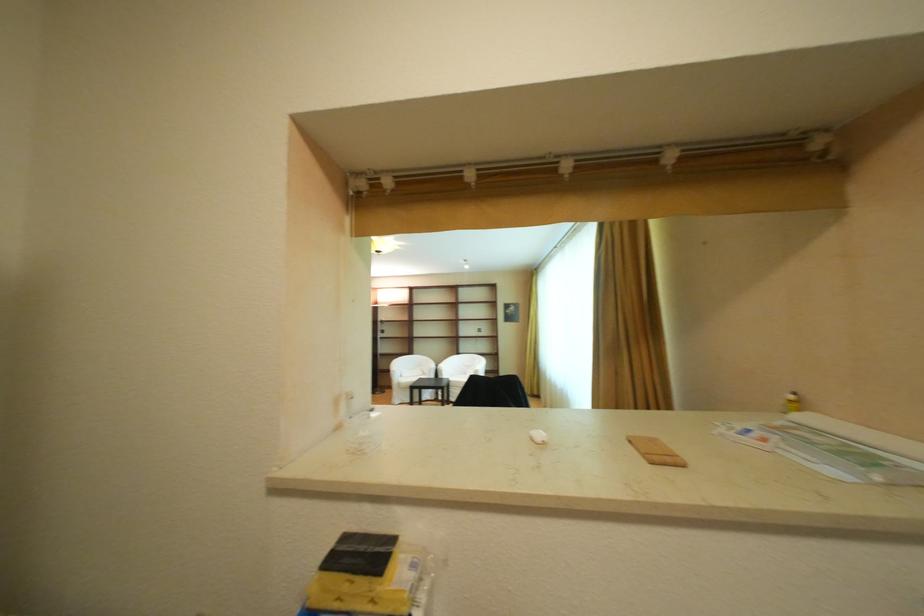
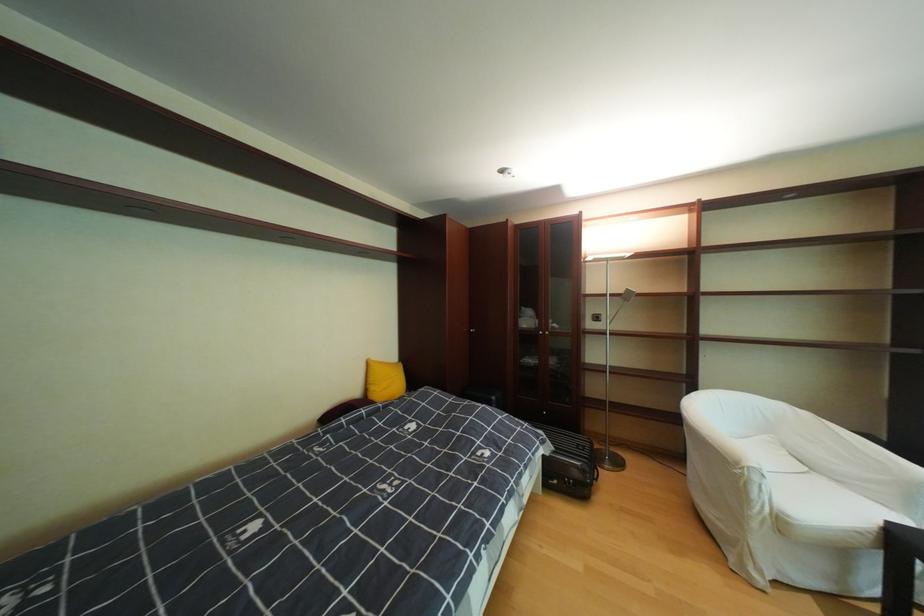
The point at [436,359] is marked in the first image. Where is the corresponding point in the second image?

(793, 407)